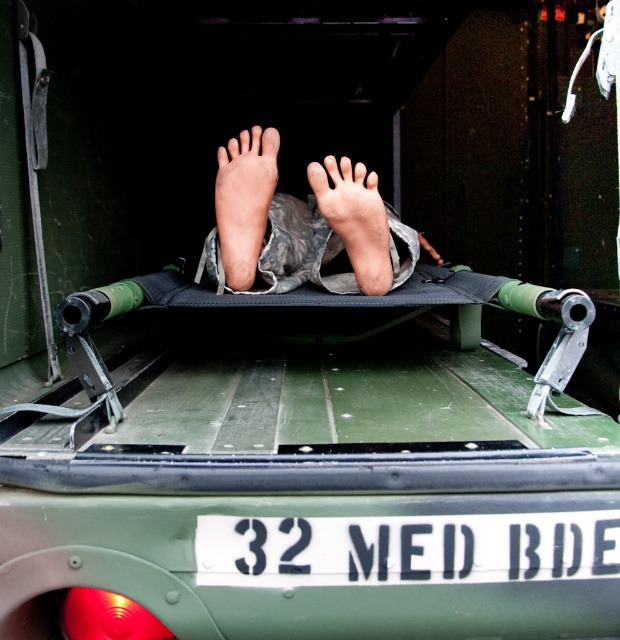
Question: Does skinny legs at center appear on the right side of pale skin foot at center?

Choices:
 (A) yes
 (B) no

Answer: (A)

Question: Which object is farther from the camera taking this photo?

Choices:
 (A) pale skin foot at center
 (B) camouflage fabric foot at center
 (C) skinny legs at center
 (D) white plastic license plate at center

Answer: (A)

Question: Which is nearer to the pale skin foot at center?

Choices:
 (A) white plastic license plate at center
 (B) camouflage fabric foot at center

Answer: (B)

Question: Is the position of skinny legs at center less distant than that of camouflage fabric foot at center?

Choices:
 (A) yes
 (B) no

Answer: (B)

Question: Is white plastic license plate at center below camouflage fabric foot at center?

Choices:
 (A) no
 (B) yes

Answer: (B)

Question: Which object appears closest to the camera in this image?

Choices:
 (A) camouflage fabric foot at center
 (B) skinny legs at center
 (C) pale skin foot at center

Answer: (A)